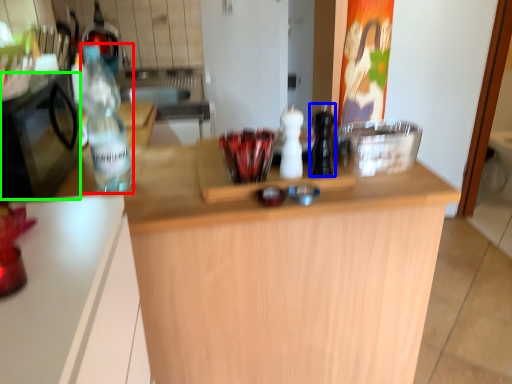
Question: Considering the real-world distances, which object is closest to bottle (highlighted by a red box)? bottle (highlighted by a blue box) or appliance (highlighted by a green box).

Choices:
 (A) bottle
 (B) appliance

Answer: (B)